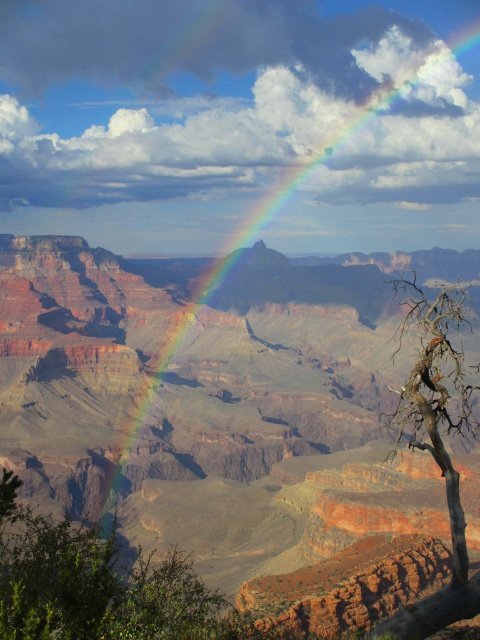
Question: Which is farther from the rainbow at upper center?

Choices:
 (A) dead wood tree at right
 (B) rustic sandstone canyon at center

Answer: (A)

Question: From the image, what is the correct spatial relationship of rainbow at upper center in relation to dead wood tree at right?

Choices:
 (A) above
 (B) below

Answer: (A)

Question: Among these points, which one is nearest to the camera?

Choices:
 (A) (406, 278)
 (B) (373, 429)
 (C) (439, 154)

Answer: (B)

Question: Does rainbow at upper center have a smaller size compared to dead wood tree at right?

Choices:
 (A) yes
 (B) no

Answer: (B)

Question: Can you confirm if rustic sandstone canyon at center is wider than dead wood tree at right?

Choices:
 (A) no
 (B) yes

Answer: (B)

Question: Which point is farther to the camera?

Choices:
 (A) rustic sandstone canyon at center
 (B) dead wood tree at right

Answer: (A)